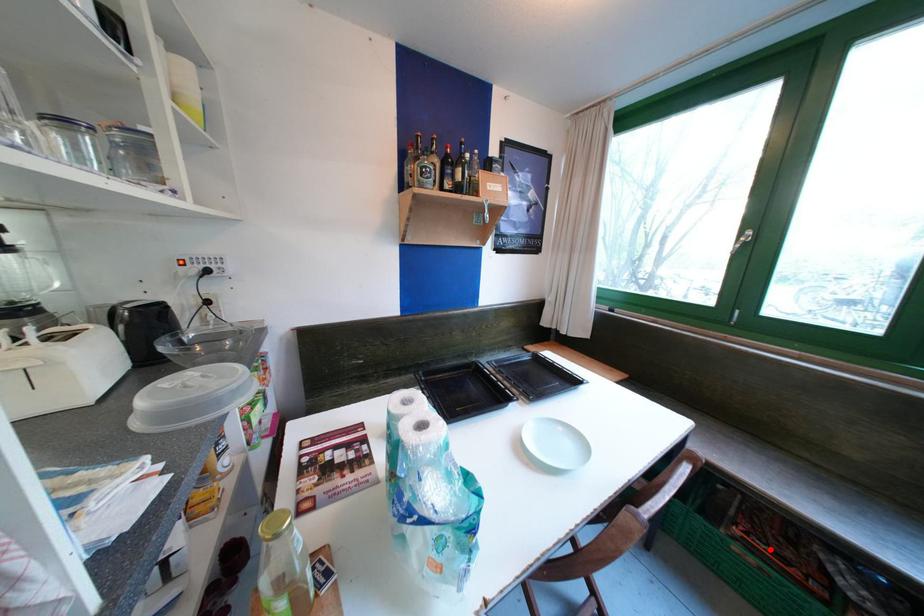
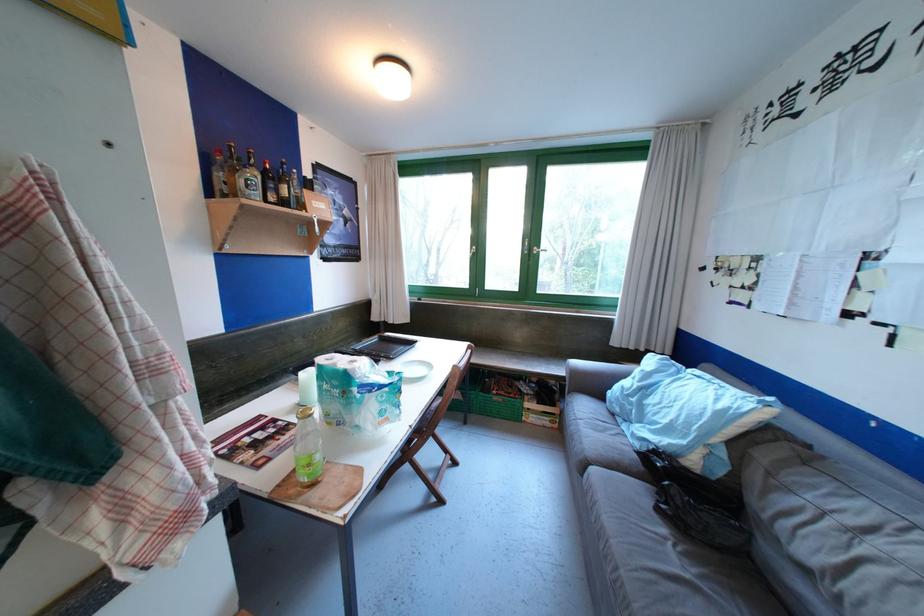
Where in the second image is the point corresponding to the highlighted location from the first image?

(509, 394)